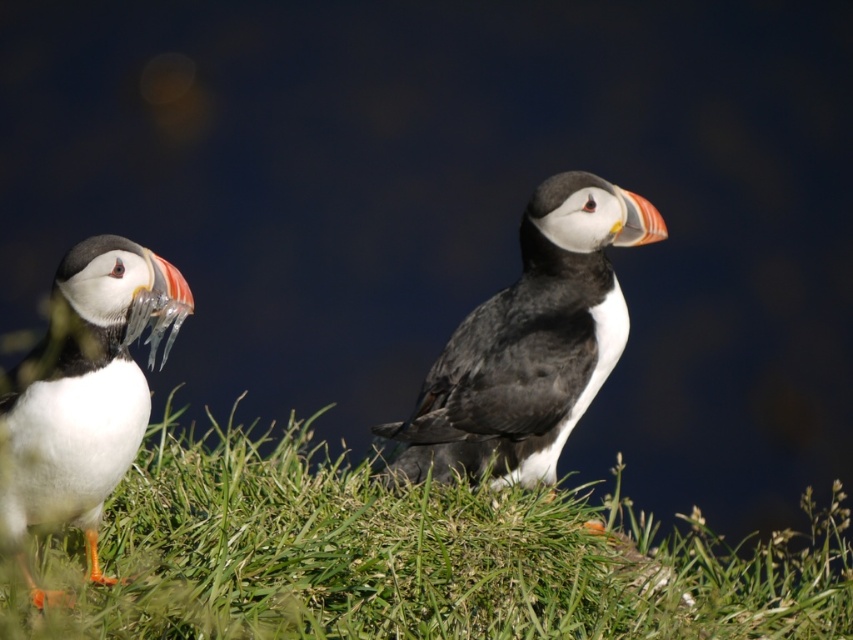
Question: Is green grass at center wider than white matte bird at left?

Choices:
 (A) yes
 (B) no

Answer: (A)

Question: Which point is farther from the camera taking this photo?

Choices:
 (A) (535, 305)
 (B) (154, 445)
 (C) (0, 483)

Answer: (B)

Question: Which point appears closest to the camera in this image?

Choices:
 (A) (418, 456)
 (B) (155, 570)
 (C) (61, 509)

Answer: (C)

Question: Among these objects, which one is nearest to the camera?

Choices:
 (A) green grass at center
 (B) white matte bird at left

Answer: (A)

Question: Does green grass at center appear on the left side of white matte bird at left?

Choices:
 (A) no
 (B) yes

Answer: (A)

Question: Does green grass at center lie in front of white matte bird at left?

Choices:
 (A) no
 (B) yes

Answer: (B)